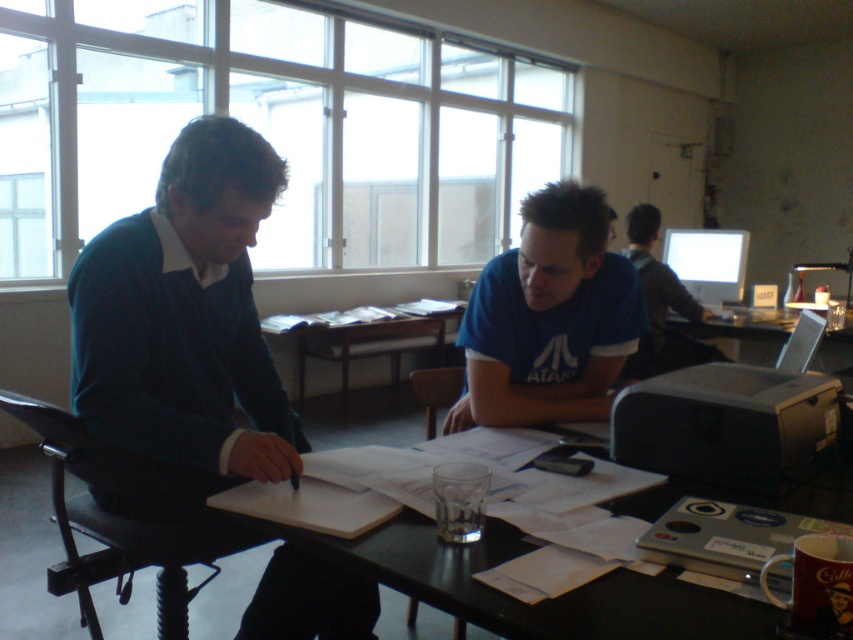
You are organizing a small event and need to place a decorative centerpiece on the table. Given the presence of the wooden at center and the metallic silver laptop at center, which object should you avoid placing the centerpiece on top of to ensure it doesn

You should avoid placing the centerpiece on the wooden at center because it is larger than the metallic silver laptop at center, so it might obstruct the laptop or take up too much space.

You are a photographer setting up a tripod in the center of the room. You need to ensure that the blue cotton shirt at center and the metallic silver laptop at center are both visible in your shot. Given their sizes, which object might require you to adjust your camera angle to include it fully?

The blue cotton shirt at center is thinner than the metallic silver laptop at center, so the laptop may require adjusting the camera angle to ensure it fits within the frame.

You are a photographer taking a picture of the blue cotton shirt at center and the metallic silver laptop at center. Which object will appear larger in the photo?

The blue cotton shirt at center will appear larger in the photo because it is closer to the viewer than the metallic silver laptop at center.